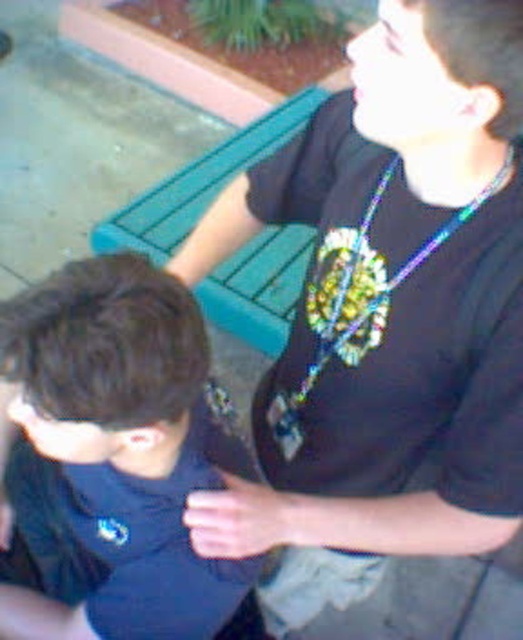
You are a photographer setting up for a photoshoot. You have a camera with a 3.5 inch wide lens. You need to capture both the black matte shirt at upper right and the holographic plastic necklace at center in the same frame. Can the lens width accommodate both objects without moving the camera?

The distance between the black matte shirt at upper right and the holographic plastic necklace at center is 4.37 inches. Since the lens is only 3.5 inches wide, it cannot capture both objects in the same frame without moving the camera.

You are a photographer setting up a shot of the scene. You need to ensure that the dark blue fabric at lower left and the teal wood park bench at upper center are both in focus. Given their heights, which object should you adjust your camera focus on first to account for the difference in their sizes?

The dark blue fabric at lower left is not as tall as the teal wood park bench at upper center, so you should focus on the teal wood park bench at upper center first since it is taller and might require more precise focus adjustment.

You are a photographer setting up a shot of the scene. You want to ensure both the dark blue fabric at lower left and the teal wood park bench at upper center are in focus. Given their sizes, which object would require you to adjust your camera settings to account for its smaller size?

The dark blue fabric at lower left is smaller than the teal wood park bench at upper center, so you would need to adjust your camera settings to focus on the smaller dark blue fabric at lower left.